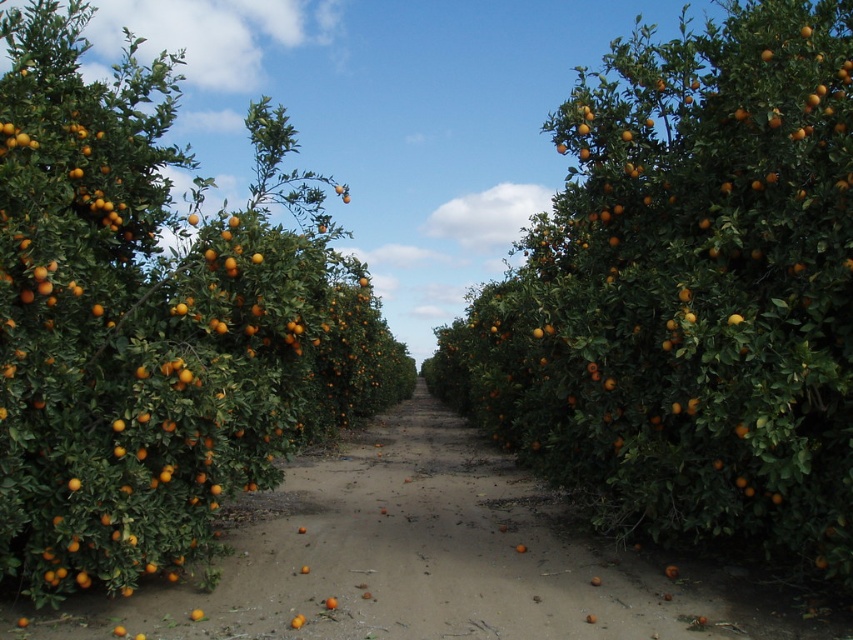
Is point (165, 77) behind point (532, 532)?

Yes, point (165, 77) is farther from viewer.

The image size is (853, 640). What do you see at coordinates (154, 321) in the screenshot? I see `orange glossy fruit at center` at bounding box center [154, 321].

The width and height of the screenshot is (853, 640). What are the coordinates of `orange glossy fruit at center` in the screenshot? It's located at (154, 321).